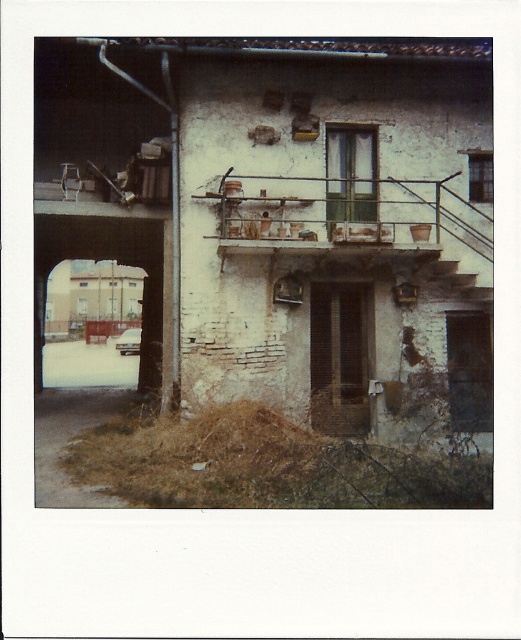
You are standing at the entrance of the building and want to reach the balcony. Which direction should you move relative to the wooden staircase at center to get to the rustic wooden balcony at center?

The rustic wooden balcony at center is positioned on the left side of the wooden staircase at center, so you should move to the left of the wooden staircase at center to reach it.

You are a painter who needs to set up an easel on the rustic wooden balcony at center. The wooden staircase at center is the only access point. Can you carry your 1.2 meter wide easel through the staircase to the balcony?

The rustic wooden balcony at center might be wider than the wooden staircase at center, but since the balcony could be wider, it doesn not guarantee the staircase is wide enough. The easel might not fit through the staircase.

You are standing in front of the weathered two story building with a rustic and somewhat neglected appearance. You see a point at coordinate (346, 214). What is located at that point?

The point at coordinate (346, 214) indicates a rustic wooden balcony at center.